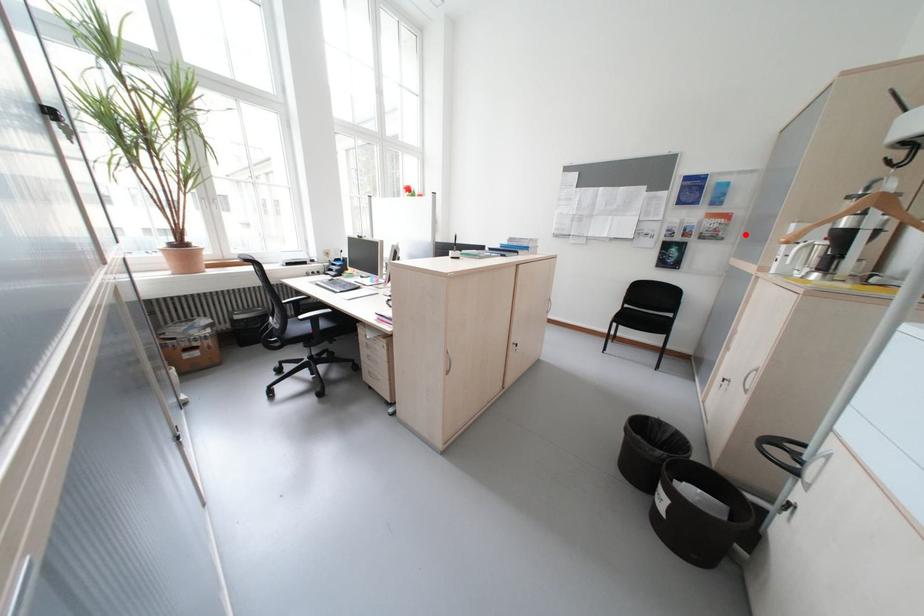
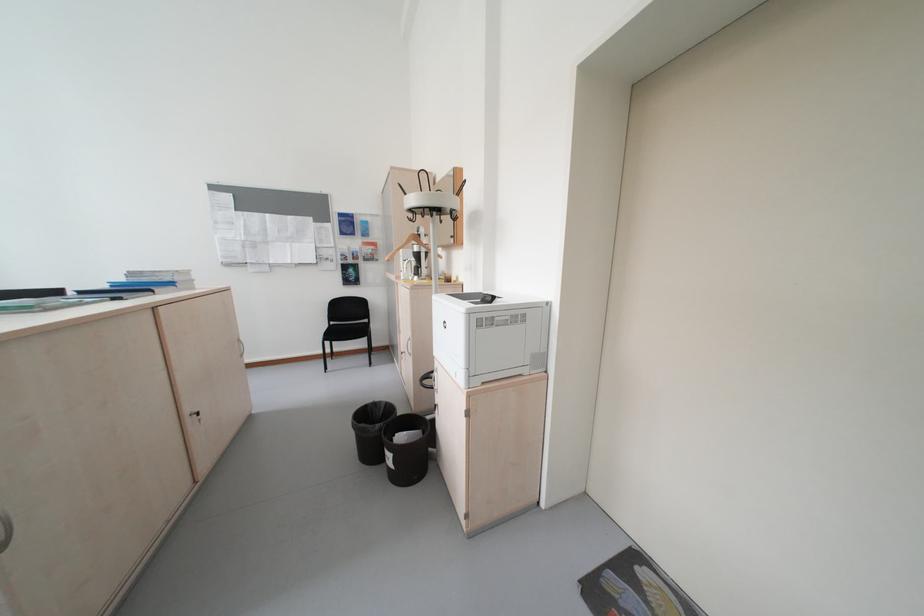
Locate, in the second image, the point that corresponds to the highlighted location in the first image.

(393, 257)